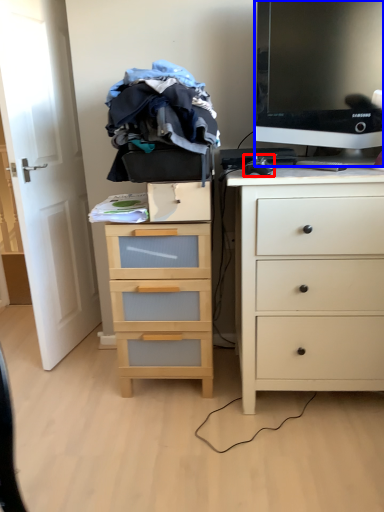
Question: Among these objects, which one is farthest to the camera, computer mouse (highlighted by a red box) or television (highlighted by a blue box)?

Choices:
 (A) computer mouse
 (B) television

Answer: (A)